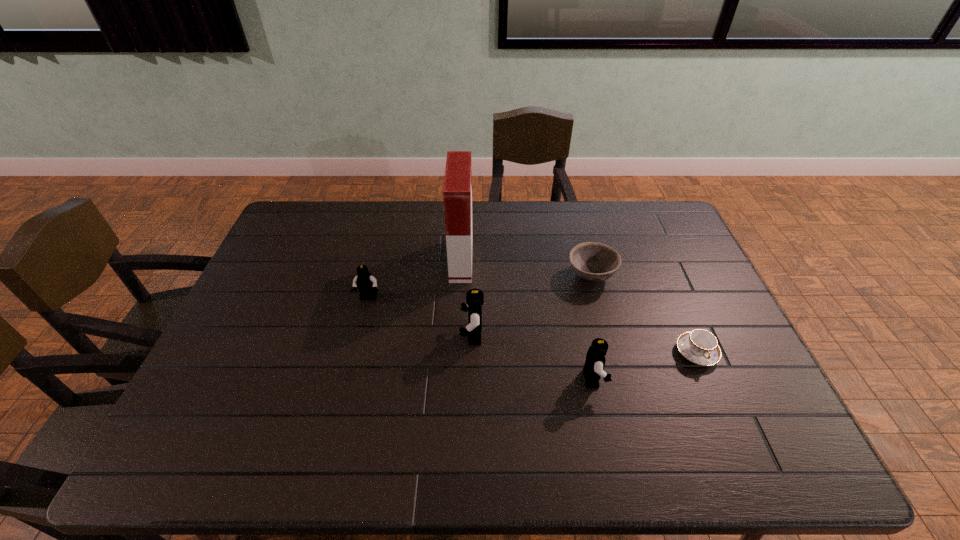
Where is `the shortest Lego`? The image size is (960, 540). the shortest Lego is located at coordinates (365, 282).

Locate an element on the screen. Image resolution: width=960 pixels, height=540 pixels. the farthest Lego is located at coordinates (365, 282).

Where is `the second Lego from left to right`? This screenshot has height=540, width=960. the second Lego from left to right is located at coordinates (474, 298).

The width and height of the screenshot is (960, 540). Find the location of `the second shortest Lego`. the second shortest Lego is located at coordinates (593, 368).

At what (x,y) coordinates should I click in order to perform the action: click on the nearest Lego. Please return your answer as a coordinate pair (x, y). Looking at the image, I should click on (593, 368).

Identify the location of the tallest object. (x=457, y=191).

This screenshot has width=960, height=540. In order to click on the shortest object in this screenshot , I will do (x=701, y=347).

Where is `the rightmost object`? Image resolution: width=960 pixels, height=540 pixels. the rightmost object is located at coordinates (701, 347).

Locate an element on the screen. This screenshot has width=960, height=540. bowl is located at coordinates (592, 261).

Find the location of a particular element. This screenshot has height=540, width=960. vacant space situated 0.340m on the front-facing side of the leftmost Lego is located at coordinates (341, 408).